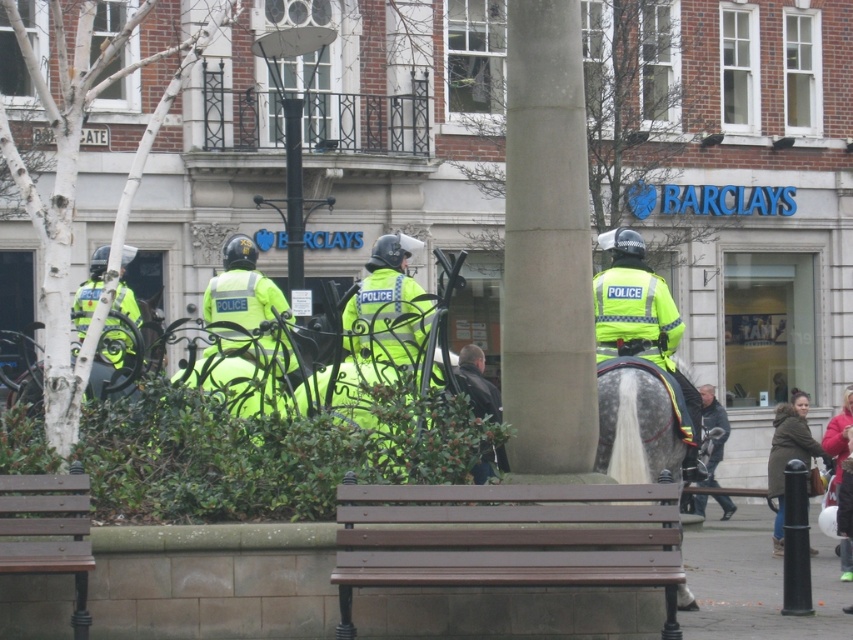
Does gray glossy horse at center appear on the right side of dark brown leather jacket at lower right?

No, gray glossy horse at center is not to the right of dark brown leather jacket at lower right.

Does gray glossy horse at center have a smaller size compared to dark brown leather jacket at lower right?

Yes.

Identify the location of gray glossy horse at center. (635, 422).

Who is more distant from viewer, (57, 500) or (128, 340)?

The point (128, 340) is more distant.

Measure the distance from wooden bench at lower left to high-visibility yellow jacket at left.

8.12 feet

Identify the location of wooden bench at lower left. (48, 531).

Does neon yellow jacket at center have a smaller size compared to dark brown leather jacket at center?

Yes, neon yellow jacket at center is smaller than dark brown leather jacket at center.

Which is more to the right, neon yellow jacket at center or dark brown leather jacket at center?

From the viewer's perspective, neon yellow jacket at center appears more on the right side.

Between point (639, 296) and point (485, 394), which one is positioned in front?

Point (485, 394) is in front.

Identify the location of neon yellow jacket at center. The width and height of the screenshot is (853, 640). (643, 326).